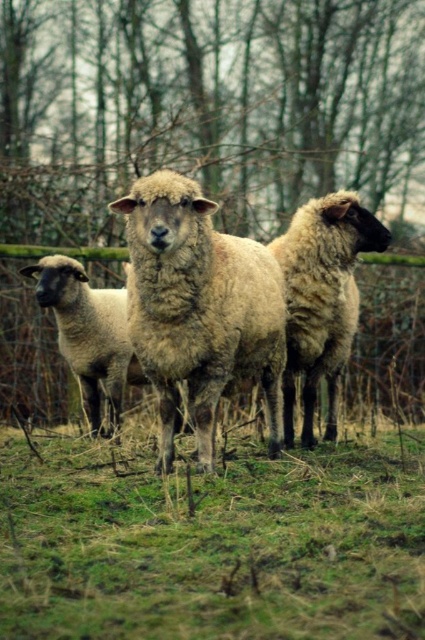
Question: Considering the real-world distances, which object is closest to the green grass at center?

Choices:
 (A) wooden fence at center
 (B) fuzzy woolen sheep at center

Answer: (B)

Question: Can you confirm if green grass at center is positioned below fuzzy woolen sheep at center?

Choices:
 (A) no
 (B) yes

Answer: (B)

Question: Can you confirm if brown woolen sheep at center is smaller than light brown woolly sheep at center?

Choices:
 (A) no
 (B) yes

Answer: (B)

Question: Which of the following is the closest to the observer?

Choices:
 (A) fuzzy woolen sheep at center
 (B) wooden fence at center

Answer: (A)

Question: Which point is farther from the camera taking this photo?

Choices:
 (A) (8, 228)
 (B) (127, 448)
 (C) (68, 291)

Answer: (A)

Question: Is fuzzy woolen sheep at center further to camera compared to light brown woolly sheep at center?

Choices:
 (A) yes
 (B) no

Answer: (B)